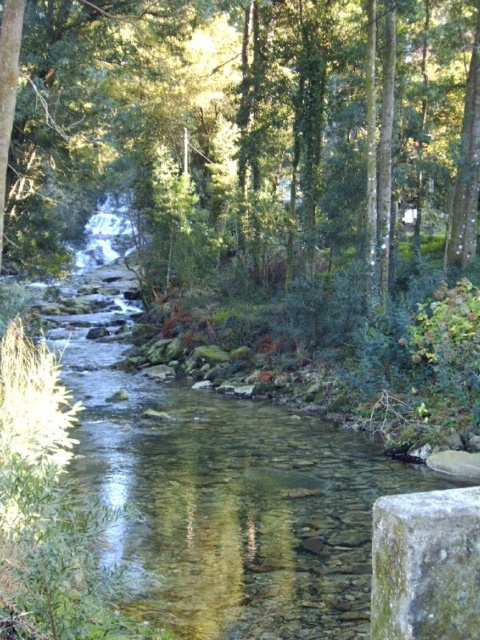
Consider the image. Is clear water stream at center to the right of green mossy stone at lower right from the viewer's perspective?

In fact, clear water stream at center is to the left of green mossy stone at lower right.

Find the location of a particular element. The width and height of the screenshot is (480, 640). clear water stream at center is located at coordinates (217, 481).

The image size is (480, 640). What are the coordinates of `clear water stream at center` in the screenshot? It's located at (217, 481).

Which of these two, green leafy tree at center or clear water stream at center, stands taller?

green leafy tree at center

Is point (458, 214) in front of point (61, 321)?

Yes.

You are a GUI agent. You are given a task and a screenshot of the screen. Output one action in this format:
    pyautogui.click(x=<x>, y=<y>)
    Task: Click on the green leafy tree at center
    This screenshot has height=640, width=480.
    Given the screenshot: What is the action you would take?
    pyautogui.click(x=243, y=129)

Is point (399, 179) positioned behind point (440, 506)?

Yes, point (399, 179) is behind point (440, 506).

Which is in front, point (135, 166) or point (441, 548)?

Point (441, 548)

At what (x,y) coordinates should I click in order to perform the action: click on green leafy tree at center. Please return your answer as a coordinate pair (x, y). Image resolution: width=480 pixels, height=640 pixels. Looking at the image, I should click on (243, 129).